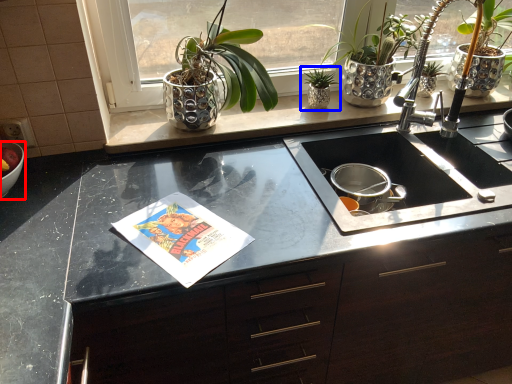
Question: Which point is closer to the camera, mixing bowl (highlighted by a red box) or houseplant (highlighted by a blue box)?

Choices:
 (A) mixing bowl
 (B) houseplant

Answer: (A)